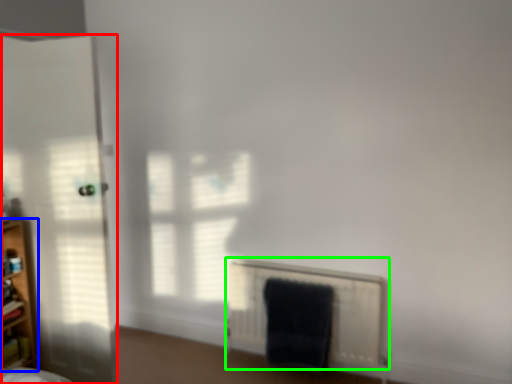
Question: Estimate the real-world distances between objects in this image. Which object is closer to door (highlighted by a red box), shelf (highlighted by a blue box) or radiator (highlighted by a green box)?

Choices:
 (A) shelf
 (B) radiator

Answer: (A)